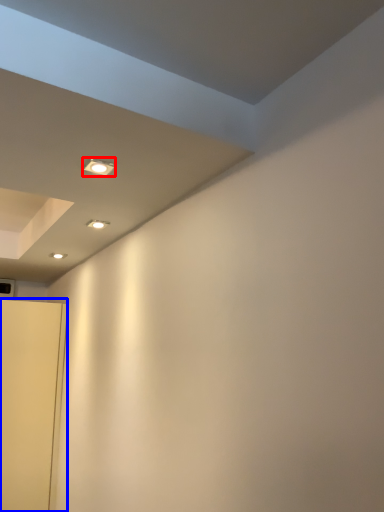
Question: Among these objects, which one is nearest to the camera, light fixture (highlighted by a red box) or door (highlighted by a blue box)?

Choices:
 (A) light fixture
 (B) door

Answer: (A)